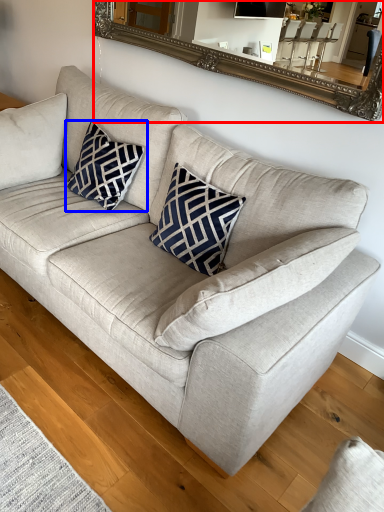
Question: Among these objects, which one is nearest to the camera, mirror (highlighted by a red box) or pillow (highlighted by a blue box)?

Choices:
 (A) mirror
 (B) pillow

Answer: (A)